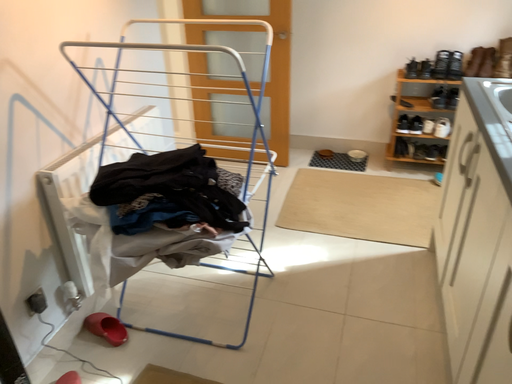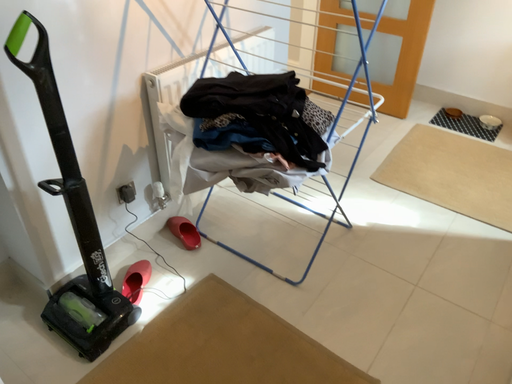
Question: How did the camera likely rotate when shooting the video?

Choices:
 (A) rotated downward
 (B) rotated upward

Answer: (A)